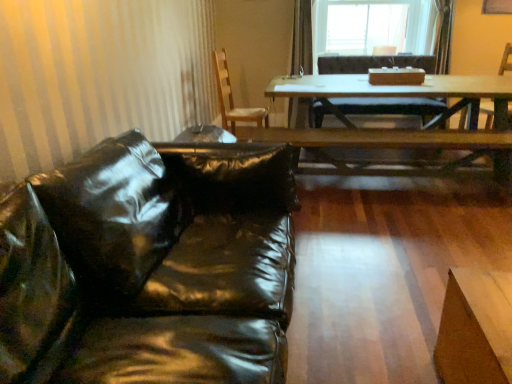
Question: From the image's perspective, is wooden armchair at right under wooden chair at center, which is counted as the first chair, starting from the left?

Choices:
 (A) yes
 (B) no

Answer: (B)

Question: Is wooden armchair at right thinner than wooden chair at center, which is counted as the first chair, starting from the left?

Choices:
 (A) no
 (B) yes

Answer: (A)

Question: From a real-world perspective, is wooden armchair at right physically below wooden chair at center, which is counted as the first chair, starting from the left?

Choices:
 (A) no
 (B) yes

Answer: (B)

Question: Is wooden armchair at right facing towards wooden chair at center, acting as the 2th chair starting from the right?

Choices:
 (A) yes
 (B) no

Answer: (B)

Question: From a real-world perspective, is wooden armchair at right on wooden chair at center, which is counted as the first chair, starting from the left?

Choices:
 (A) no
 (B) yes

Answer: (A)

Question: From a real-world perspective, is wooden chair at center, acting as the 2th chair starting from the right, positioned above or below wooden table at center?

Choices:
 (A) below
 (B) above

Answer: (B)

Question: In terms of height, does wooden chair at center, acting as the 2th chair starting from the right, look taller or shorter compared to wooden table at center?

Choices:
 (A) short
 (B) tall

Answer: (B)

Question: In the image, is wooden chair at center, which is counted as the first chair, starting from the left, positioned in front of or behind wooden table at center?

Choices:
 (A) behind
 (B) front

Answer: (A)

Question: Is wooden chair at center, acting as the 2th chair starting from the right, situated inside wooden table at center or outside?

Choices:
 (A) inside
 (B) outside

Answer: (B)

Question: Looking at their shapes, would you say glossy black leather couch at left is wider or thinner than wooden armchair at right?

Choices:
 (A) thin
 (B) wide

Answer: (B)

Question: In terms of size, does glossy black leather couch at left appear bigger or smaller than wooden armchair at right?

Choices:
 (A) big
 (B) small

Answer: (A)

Question: Based on their positions, is glossy black leather couch at left located to the left or right of wooden armchair at right?

Choices:
 (A) left
 (B) right

Answer: (A)

Question: Considering the positions of point (94, 314) and point (492, 107), is point (94, 314) closer or farther from the camera than point (492, 107)?

Choices:
 (A) closer
 (B) farther

Answer: (A)

Question: From a real-world perspective, is wooden chair at center, which is counted as the first chair, starting from the left, above or below glossy black leather couch at left?

Choices:
 (A) above
 (B) below

Answer: (A)

Question: From the image's perspective, is wooden chair at center, acting as the 2th chair starting from the right, positioned above or below glossy black leather couch at left?

Choices:
 (A) below
 (B) above

Answer: (B)